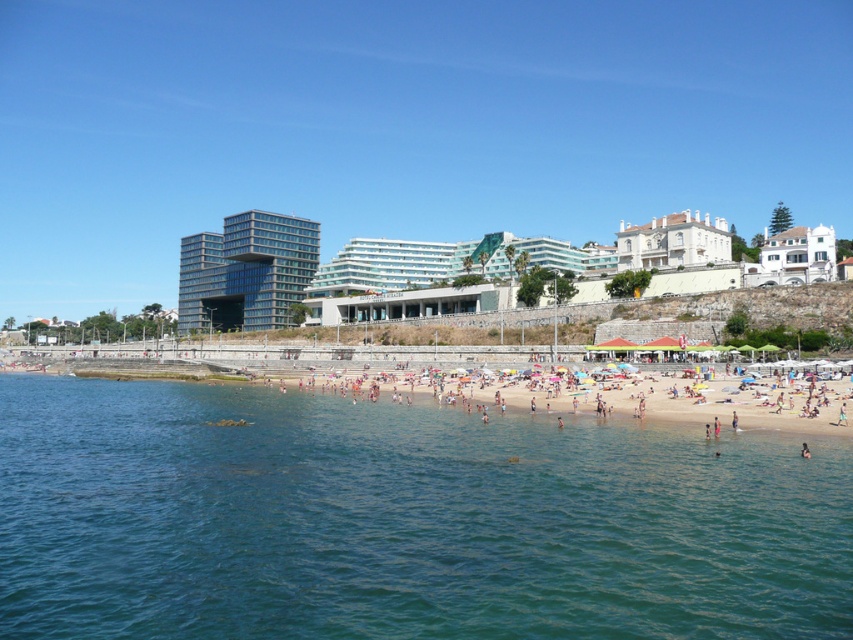
Question: Considering the relative positions of clear blue water at beach center and white matte house at upper right in the image provided, where is clear blue water at beach center located with respect to white matte house at upper right?

Choices:
 (A) left
 (B) right

Answer: (A)

Question: Among these points, which one is farthest from the camera?

Choices:
 (A) (805, 444)
 (B) (131, 500)
 (C) (257, 289)
 (D) (666, 257)

Answer: (C)

Question: Which point is farther to the camera?

Choices:
 (A) glassy modern building at center
 (B) dark blue fabric at beach center
 (C) white matte house at upper right

Answer: (A)

Question: Which object is closer to the camera taking this photo?

Choices:
 (A) white matte house at upper right
 (B) glassy modern building at center
 (C) dark blue fabric at beach center

Answer: (C)

Question: Does clear blue water at beach center have a larger size compared to glassy modern building at center?

Choices:
 (A) no
 (B) yes

Answer: (A)

Question: In this image, where is clear blue water at beach center located relative to white glossy house at upper right?

Choices:
 (A) right
 (B) left

Answer: (B)